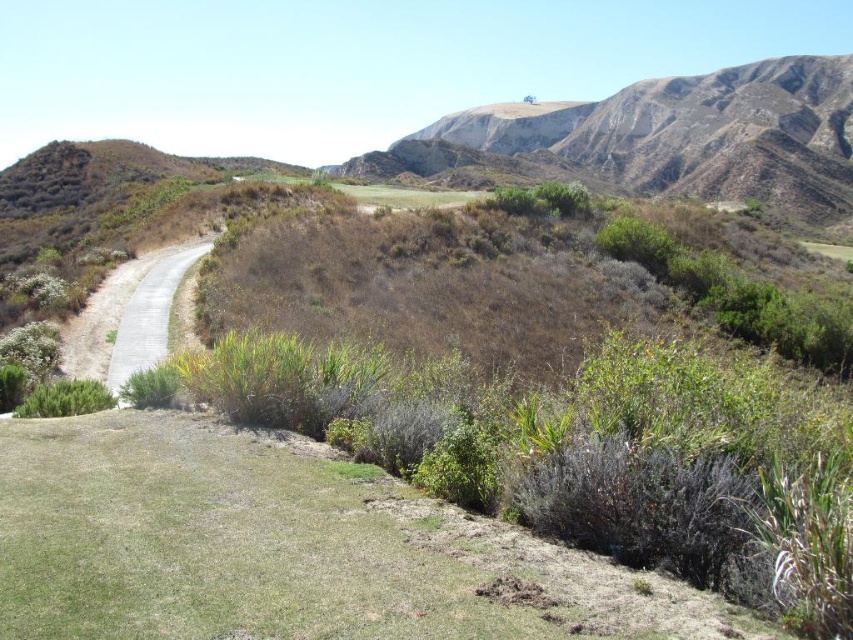
Question: Which of the following is the farthest from the observer?

Choices:
 (A) (608, 148)
 (B) (126, 620)

Answer: (A)

Question: Does green grassy at lower left have a larger size compared to rugged brown mountain at upper right?

Choices:
 (A) no
 (B) yes

Answer: (A)

Question: Which point is farther to the camera?

Choices:
 (A) coord(813,74)
 (B) coord(12,563)

Answer: (A)

Question: Where is green grassy at lower left located in relation to rugged brown mountain at upper right in the image?

Choices:
 (A) left
 (B) right

Answer: (A)

Question: In this image, where is green grassy at lower left located relative to rugged brown mountain at upper right?

Choices:
 (A) below
 (B) above

Answer: (A)

Question: Which of the following is the closest to the observer?

Choices:
 (A) (397, 556)
 (B) (691, 109)

Answer: (A)